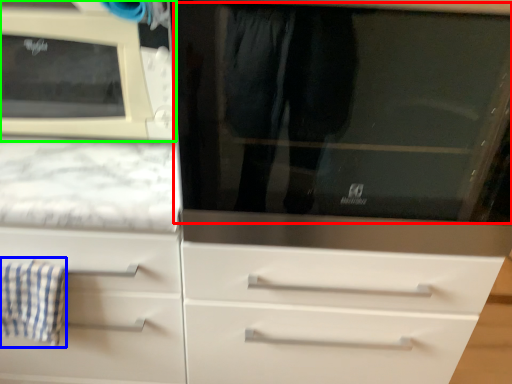
Question: Which object is positioned farthest from glass door (highlighted by a red box)? Select from bath towel (highlighted by a blue box) and microwave oven (highlighted by a green box).

Choices:
 (A) bath towel
 (B) microwave oven

Answer: (A)